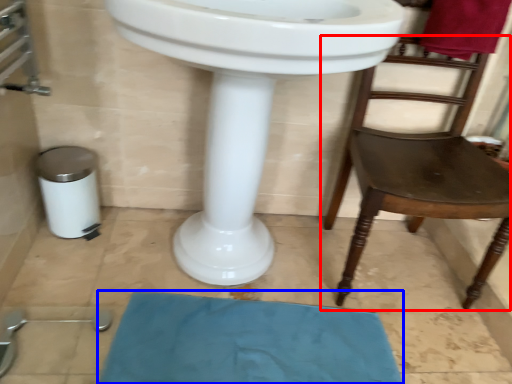
Question: Which of the following is the closest to the observer, chair (highlighted by a red box) or bath mat (highlighted by a blue box)?

Choices:
 (A) chair
 (B) bath mat

Answer: (A)